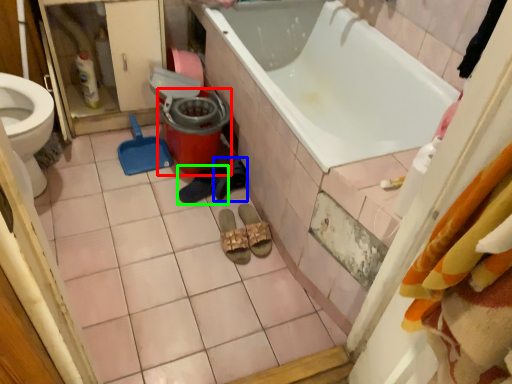
Question: Based on their relative distances, which object is farther from potty (highlighted by a red box)? Choose from footwear (highlighted by a blue box) and footwear (highlighted by a green box).

Choices:
 (A) footwear
 (B) footwear

Answer: (A)